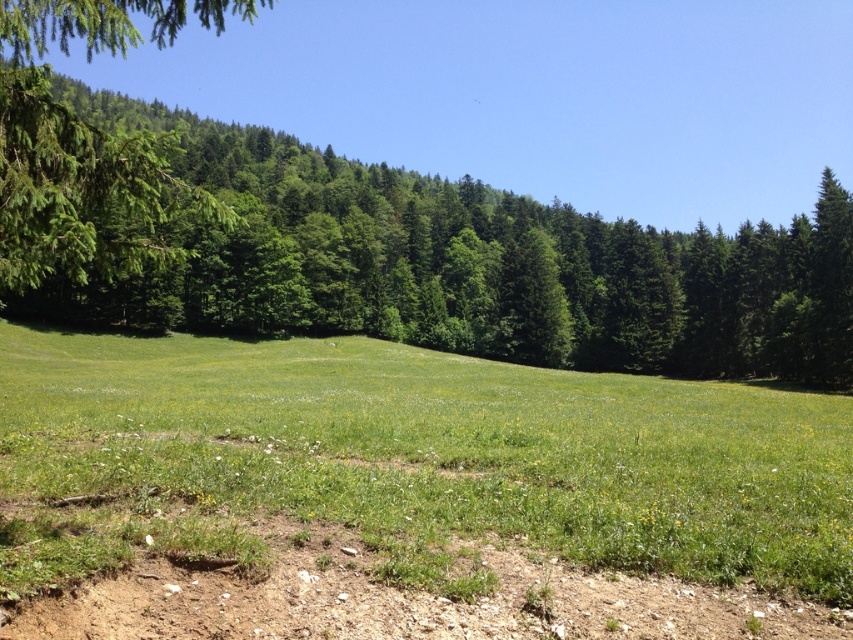
You are an observer standing at the center of the grassy field. You see the green leafy tree at upper left and the green leafy tree at left. Which tree is closer to you?

The green leafy tree at left is behind the green leafy tree at upper left, so the green leafy tree at upper left is closer to you.

You are planning to set up a picnic area in the image. You have a large picnic blanket that requires a spacious area. Which location between the green grassy field at center and the brown dirt track at lower center would be more suitable for your picnic setup?

The green grassy field at center is larger in size than the brown dirt track at lower center, making it more suitable for setting up a picnic area with a large blanket.

You are standing at the edge of the green grassy field at center and want to walk to the brown dirt track at lower center. Which direction should you head to reach the track?

The green grassy field at center is positioned on the left side of the brown dirt track at lower center, so you should head to the right to reach the track.